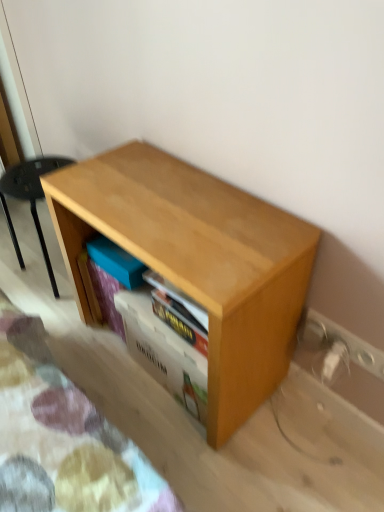
I want to click on vacant region in front of wooden shelf at center, so click(x=196, y=445).